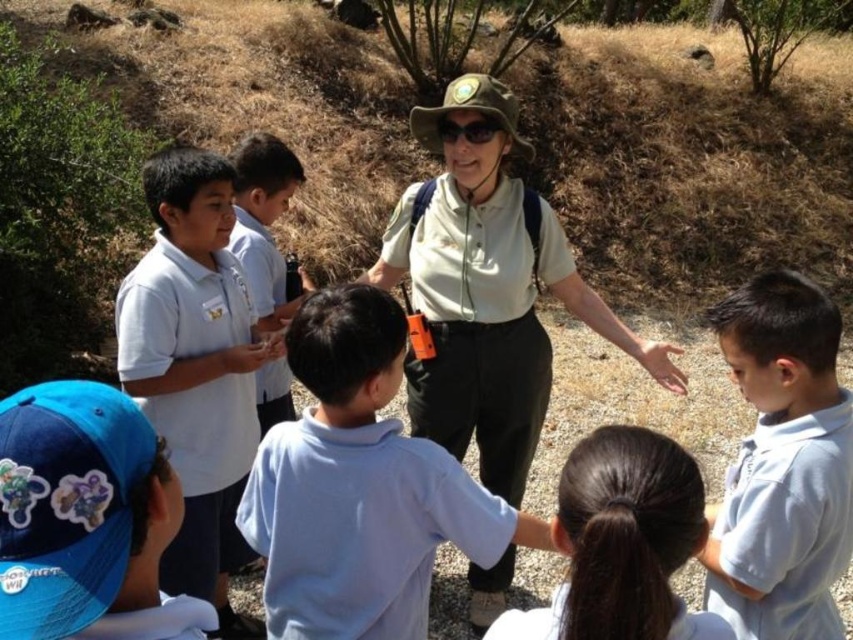
Question: Does white matte uniform at lower center have a lesser width compared to smooth skin hand at center?

Choices:
 (A) no
 (B) yes

Answer: (A)

Question: Can you confirm if light blue shirt at right is smaller than smooth skin hand at center?

Choices:
 (A) no
 (B) yes

Answer: (A)

Question: Does light blue shirt at right have a greater width compared to black smooth hair at center?

Choices:
 (A) yes
 (B) no

Answer: (A)

Question: Which object is the closest to the smooth skin hand at center?

Choices:
 (A) white matte uniform at lower center
 (B) white cotton shirt at center
 (C) light blue shirt at right
 (D) black smooth hair at center

Answer: (C)

Question: Among these objects, which one is farthest from the camera?

Choices:
 (A) matte khaki shirt at center
 (B) smooth skin hand at center
 (C) white cotton shirt at center
 (D) white smooth shirt at center

Answer: (A)

Question: Which object is closer to the camera taking this photo?

Choices:
 (A) white uniform shirt at center
 (B) white matte shirt at center
 (C) white smooth shirt at center

Answer: (C)